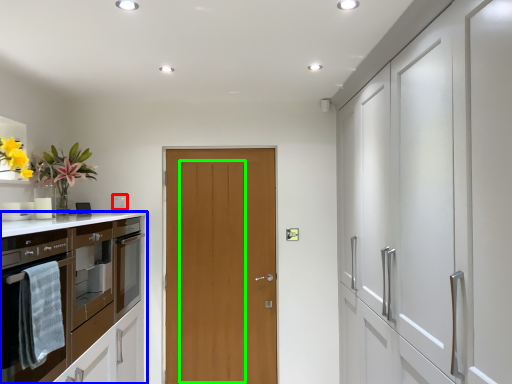
Question: Estimate the real-world distances between objects in this image. Which object is closer to appliance (highlighted by a red box), cabinetry (highlighted by a blue box) or door (highlighted by a green box)?

Choices:
 (A) cabinetry
 (B) door

Answer: (B)